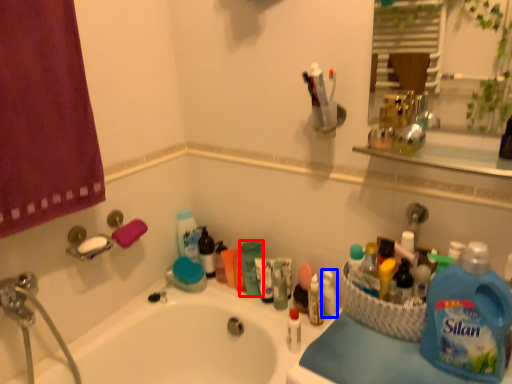
Question: Which point is closer to the camera, cleaning product (highlighted by a red box) or toiletry (highlighted by a blue box)?

Choices:
 (A) cleaning product
 (B) toiletry

Answer: (B)